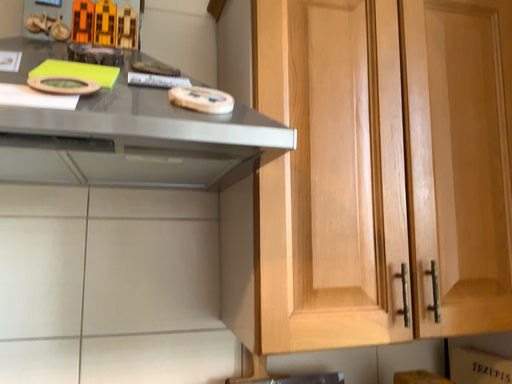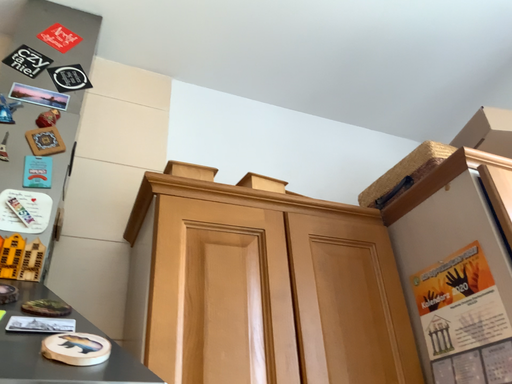
Question: How did the camera likely rotate when shooting the video?

Choices:
 (A) rotated right
 (B) rotated left

Answer: (A)